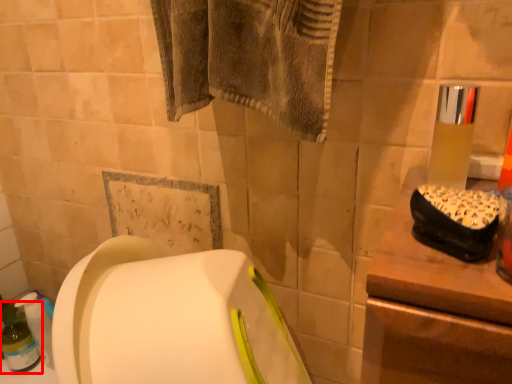
Question: In this image, where is bottle (annotated by the red box) located relative to mouthwash?

Choices:
 (A) right
 (B) left

Answer: (B)